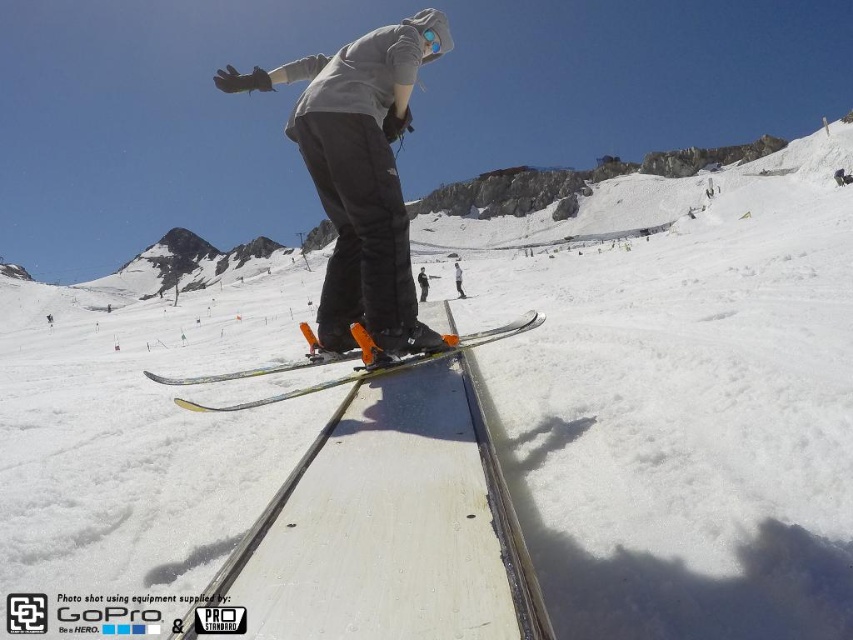
Which is behind, point (225, 77) or point (461, 284)?

The point (461, 284) is more distant.

Is matte gray hoodie at center positioned behind white matte snowboarder at center?

No, matte gray hoodie at center is in front of white matte snowboarder at center.

I want to click on matte gray hoodie at center, so click(x=360, y=173).

In the scene shown: Who is shorter, matte gray hoodie at center or matte black skis at center?

matte black skis at center is shorter.

Between matte gray hoodie at center and matte black skis at center, which one appears on the right side from the viewer's perspective?

From the viewer's perspective, matte black skis at center appears more on the right side.

At what (x,y) coordinates should I click in order to perform the action: click on matte gray hoodie at center. Please return your answer as a coordinate pair (x, y). Looking at the image, I should click on (360, 173).

Locate an element on the screen. matte gray hoodie at center is located at coordinates (360, 173).

Between shiny metallic skis at center and matte black skis at center, which one appears on the left side from the viewer's perspective?

matte black skis at center is more to the left.

Which is behind, point (248, 404) or point (422, 292)?

Positioned behind is point (422, 292).

Does point (502, 326) come behind point (424, 280)?

No, it is in front of (424, 280).

Locate an element on the screen. This screenshot has width=853, height=640. shiny metallic skis at center is located at coordinates pos(358,364).